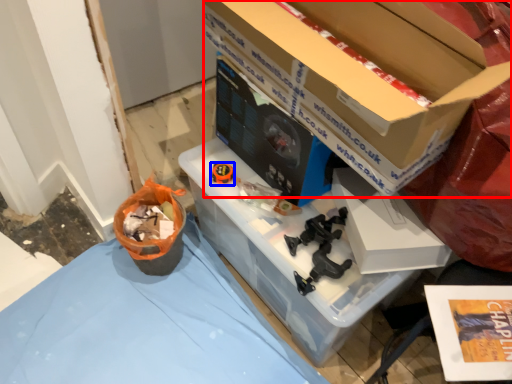
Question: Which of the following is the closest to the observer, box (highlighted by a red box) or toy (highlighted by a blue box)?

Choices:
 (A) box
 (B) toy

Answer: (A)